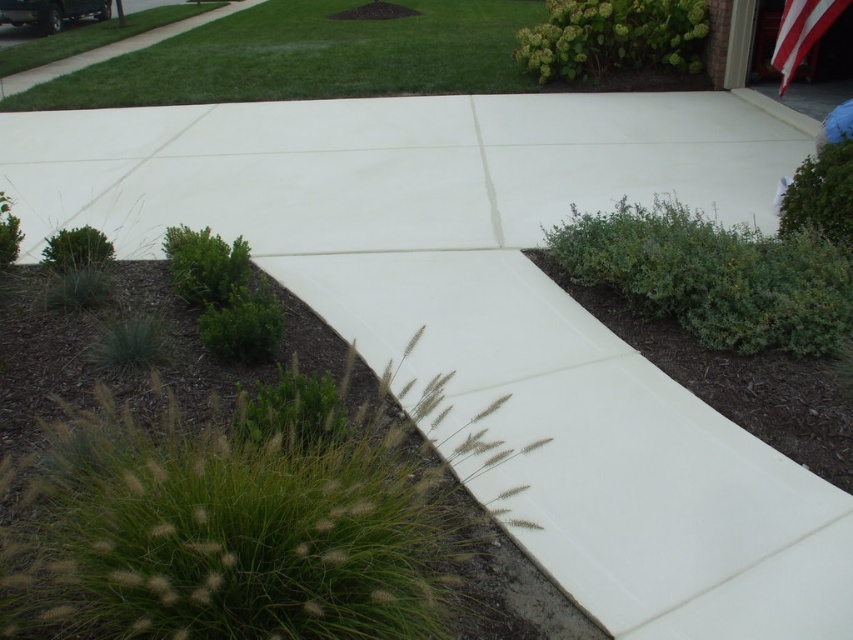
Question: Is green grass at upper center closer to camera compared to striped fabric flag at upper right?

Choices:
 (A) no
 (B) yes

Answer: (A)

Question: Does green grass at upper center have a greater width compared to striped fabric flag at upper right?

Choices:
 (A) no
 (B) yes

Answer: (B)

Question: Which point is farther to the camera?

Choices:
 (A) striped fabric flag at upper right
 (B) green grass at upper center

Answer: (B)

Question: Considering the relative positions of green grass at upper center and striped fabric flag at upper right in the image provided, where is green grass at upper center located with respect to striped fabric flag at upper right?

Choices:
 (A) below
 (B) above

Answer: (B)

Question: Which point is farther to the camera?

Choices:
 (A) (781, 26)
 (B) (534, 13)

Answer: (B)